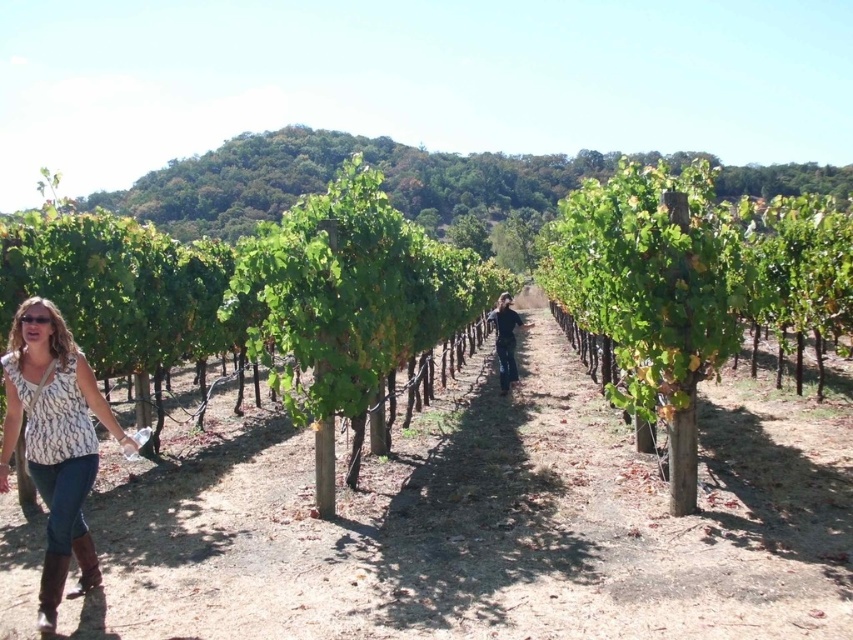
You are a visitor in the vineyard and you want to take a photo of the transparent plastic goggles at lower left without the brown suede boot at lower left blocking it. Which direction should you move to achieve this?

The brown suede boot at lower left is in front of transparent plastic goggles at lower left. To take a photo of the transparent plastic goggles at lower left without the brown suede boot at lower left blocking it, you should move to the right or left to position yourself so that the boot is no longer in front of the goggles.

You are a photographer standing at the edge of the vineyard and want to take a photo that includes both the white printed blouse at lower left and the brown suede boot at lower left. Which object will appear larger in the photo?

The white printed blouse at lower left is taller than the brown suede boot at lower left, so it will appear larger in the photo.

You are standing at the point with coordinates point [49,480] and want to walk towards the point with coordinates point [61,580]. Which direction should you move in relation to the vineyard rows?

Point [49,480] is behind point [61,580], so you should move forward along the vineyard rows to reach it.